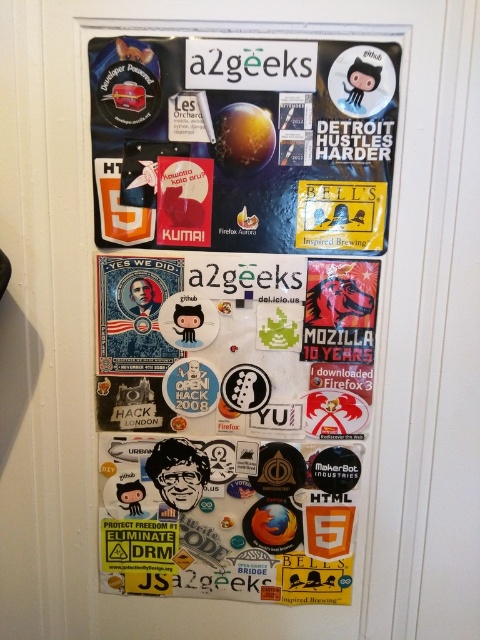
Does multicolored stickers at center appear on the left side of matte paper poster at upper center?

Correct, you'll find multicolored stickers at center to the left of matte paper poster at upper center.

Based on the photo, is multicolored stickers at center taller than matte paper poster at upper center?

Indeed, multicolored stickers at center has a greater height compared to matte paper poster at upper center.

Locate an element on the screen. The image size is (480, 640). multicolored stickers at center is located at coordinates (237, 308).

This screenshot has width=480, height=640. In order to click on multicolored stickers at center in this screenshot , I will do `click(237, 308)`.